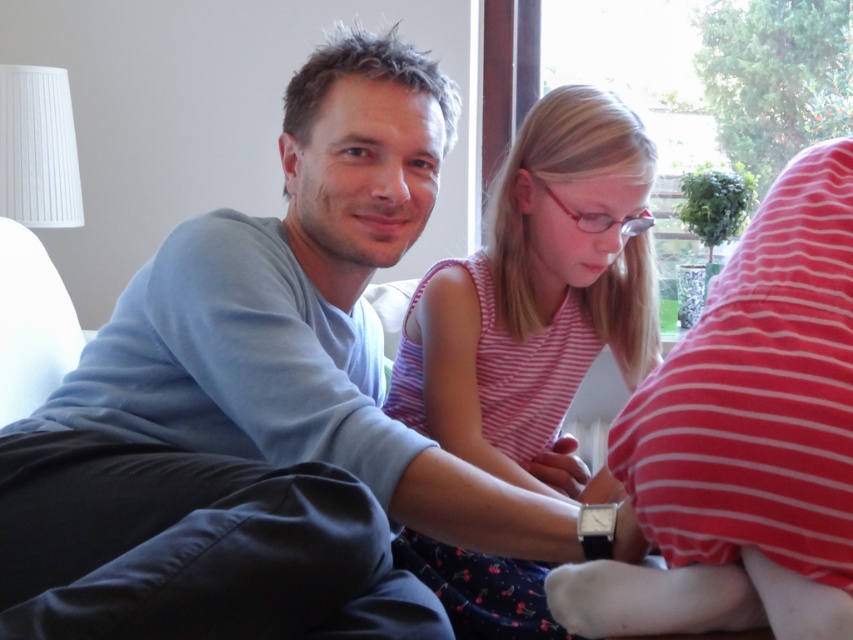
Question: Among these points, which one is farthest from the camera?

Choices:
 (A) pyautogui.click(x=265, y=291)
 (B) pyautogui.click(x=524, y=128)

Answer: (B)

Question: Can you confirm if light blue sweater at center is wider than striped cotton shirt at center?

Choices:
 (A) yes
 (B) no

Answer: (A)

Question: Where is light blue sweater at center located in relation to striped cotton shirt at center in the image?

Choices:
 (A) below
 (B) above

Answer: (B)

Question: Does light blue sweater at center appear over striped cotton shirt at center?

Choices:
 (A) no
 (B) yes

Answer: (B)